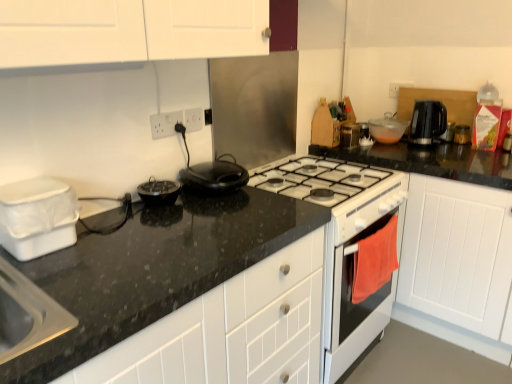
Find the location of a particular element. This screenshot has width=512, height=384. vacant area that is in front of black matte waffle maker at center, which is counted as the 5th kitchen appliance, starting from the right is located at coordinates (218, 211).